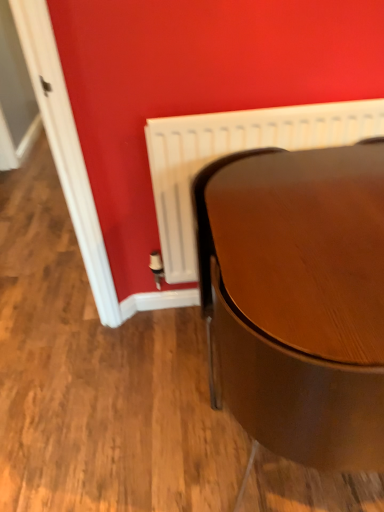
In order to face glossy wood table at lower right, should I rotate leftwards or rightwards?

It's best to rotate right around 19.927 degrees.

What do you see at coordinates (299, 298) in the screenshot?
I see `glossy wood table at lower right` at bounding box center [299, 298].

Find the location of a particular element. This screenshot has height=512, width=384. glossy wood table at lower right is located at coordinates (299, 298).

This screenshot has width=384, height=512. Find the location of `white plastic radiator at center`. white plastic radiator at center is located at coordinates click(233, 152).

This screenshot has width=384, height=512. What do you see at coordinates (233, 152) in the screenshot? I see `white plastic radiator at center` at bounding box center [233, 152].

The height and width of the screenshot is (512, 384). Identify the location of glossy wood table at lower right. (299, 298).

Is glossy wood table at lower right to the right of white plastic radiator at center from the viewer's perspective?

Correct, you'll find glossy wood table at lower right to the right of white plastic radiator at center.

Is glossy wood table at lower right further to camera compared to white plastic radiator at center?

No, it is in front of white plastic radiator at center.

Which point is more forward, [365,426] or [260,125]?

The point [365,426] is closer to the camera.

From the image's perspective, is glossy wood table at lower right located beneath white plastic radiator at center?

Yes.

From a real-world perspective, is glossy wood table at lower right physically located above or below white plastic radiator at center?

glossy wood table at lower right is situated lower than white plastic radiator at center in the real world.

Does glossy wood table at lower right have a lesser width compared to white plastic radiator at center?

No.

Can you confirm if glossy wood table at lower right is taller than white plastic radiator at center?

Correct, glossy wood table at lower right is much taller as white plastic radiator at center.

Which of these two, glossy wood table at lower right or white plastic radiator at center, is bigger?

glossy wood table at lower right.

Is glossy wood table at lower right outside of white plastic radiator at center?

Yes, glossy wood table at lower right is located beyond the bounds of white plastic radiator at center.

Is glossy wood table at lower right far from white plastic radiator at center?

No, glossy wood table at lower right is not far from white plastic radiator at center.

Is glossy wood table at lower right oriented away from white plastic radiator at center?

Yes, white plastic radiator at center is at the back of glossy wood table at lower right.

In order to click on table lying in front of the white plastic radiator at center in this screenshot , I will do `click(299, 298)`.

Which object is positioned more to the right, white plastic radiator at center or glossy wood table at lower right?

glossy wood table at lower right.

Who is more distant, white plastic radiator at center or glossy wood table at lower right?

Positioned behind is white plastic radiator at center.

Which point is more distant from viewer, [164,222] or [326,155]?

Positioned behind is point [164,222].

From the image's perspective, which is below, white plastic radiator at center or glossy wood table at lower right?

glossy wood table at lower right appears lower in the image.

From the picture: From a real-world perspective, who is located higher, white plastic radiator at center or glossy wood table at lower right?

white plastic radiator at center.

Based on the photo, is white plastic radiator at center wider or thinner than glossy wood table at lower right?

Clearly, white plastic radiator at center has less width compared to glossy wood table at lower right.

Is white plastic radiator at center taller or shorter than glossy wood table at lower right?

white plastic radiator at center is shorter than glossy wood table at lower right.

Does white plastic radiator at center have a smaller size compared to glossy wood table at lower right?

Yes.

Is white plastic radiator at center inside the boundaries of glossy wood table at lower right, or outside?

white plastic radiator at center is not enclosed by glossy wood table at lower right.

Is the surface of white plastic radiator at center in direct contact with glossy wood table at lower right?

No, white plastic radiator at center is not in contact with glossy wood table at lower right.

Is white plastic radiator at center facing away from glossy wood table at lower right?

Yes, white plastic radiator at center is positioned with its back facing glossy wood table at lower right.

How many degrees apart are the facing directions of white plastic radiator at center and glossy wood table at lower right?

white plastic radiator at center and glossy wood table at lower right are facing 0.167 degrees away from each other.

How much distance is there between white plastic radiator at center and glossy wood table at lower right?

white plastic radiator at center and glossy wood table at lower right are 16.28 inches apart from each other.

This screenshot has height=512, width=384. I want to click on radiator located on the left of glossy wood table at lower right, so click(233, 152).

Find the location of a particular element. The image size is (384, 512). table below the white plastic radiator at center (from a real-world perspective) is located at coordinates (299, 298).

Where is `radiator lying behind the glossy wood table at lower right`? radiator lying behind the glossy wood table at lower right is located at coordinates 233,152.